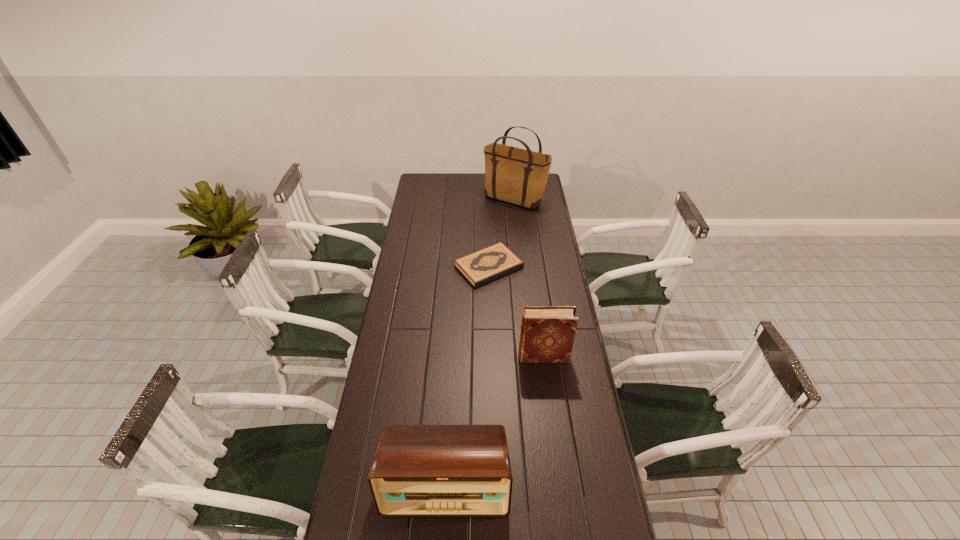
Identify the location of the tallest object. (514, 175).

The width and height of the screenshot is (960, 540). I want to click on the farthest object, so click(514, 175).

Identify the location of the third farthest object. (547, 335).

Find the location of `the taller hardback book`. the taller hardback book is located at coordinates (547, 335).

Locate an element on the screen. the nearest object is located at coordinates (418, 470).

Identify the location of the second farthest object. This screenshot has width=960, height=540. (485, 265).

Where is `the shortest object`? the shortest object is located at coordinates (485, 265).

Identify the location of free region located 0.180m on the front of the tallest object. This screenshot has height=540, width=960. (517, 231).

Locate an element on the screen. vacant space located on the spine side of the taller hardback book is located at coordinates click(x=450, y=356).

This screenshot has height=540, width=960. Identify the location of free space located on the spine side of the taller hardback book. (422, 356).